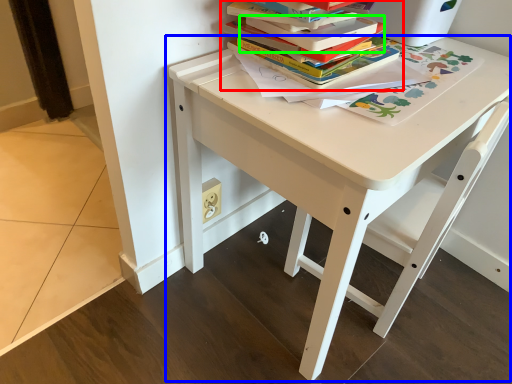
Question: Which object is the closest to the book (highlighted by a red box)? Choose among these: table (highlighted by a blue box) or paperback book (highlighted by a green box).

Choices:
 (A) table
 (B) paperback book

Answer: (B)